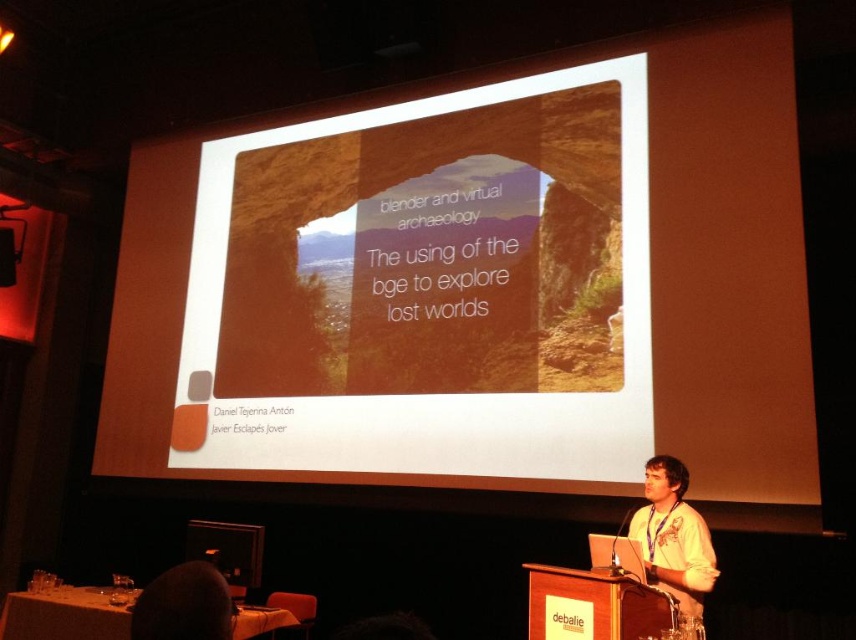
Is matte orange slide at center taller than white shirt at center?

Indeed, matte orange slide at center has a greater height compared to white shirt at center.

Is matte orange slide at center above white shirt at center?

Yes, matte orange slide at center is above white shirt at center.

Measure the distance between matte orange slide at center and camera.

matte orange slide at center is 4.68 meters away from camera.

In order to click on matte orange slide at center in this screenshot , I will do `click(431, 394)`.

Who is positioned more to the right, matte orange slide at center or dark hair at lower left?

From the viewer's perspective, matte orange slide at center appears more on the right side.

Which is in front, point (260, 468) or point (149, 600)?

Point (149, 600) is more forward.

Does point (563, 400) come closer to viewer compared to point (223, 609)?

No, (563, 400) is further to viewer.

Image resolution: width=856 pixels, height=640 pixels. I want to click on matte orange slide at center, so click(431, 394).

Does white shirt at center have a lesser height compared to dark hair at lower left?

Incorrect, white shirt at center's height does not fall short of dark hair at lower left's.

Is white shirt at center positioned before dark hair at lower left?

No, white shirt at center is further to the viewer.

Does point (684, 579) come behind point (203, 621)?

Yes, point (684, 579) is behind point (203, 621).

This screenshot has height=640, width=856. I want to click on white shirt at center, so [x=673, y=536].